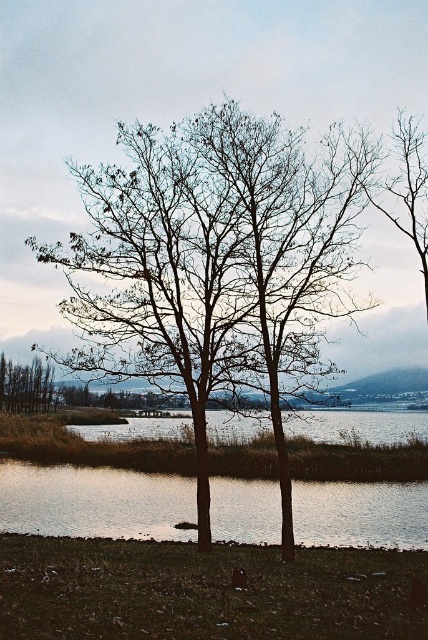
You are an ornithologist observing birds in the scene. You notice two potential nesting spots among the bare branches at center and the brown matte tree at left. Which nesting spot is higher up in the scene?

The bare branches at center is located above the brown matte tree at left, so the nesting spot at the bare branches at center is higher up in the scene.

Consider the image. You are an artist setting up an easel to paint the scene. You want to ensure that the bare branches at center and reflective glass water at center are proportionally accurate in your painting. Which object should you make wider in your artwork to maintain the correct proportions?

The reflective glass water at center should be made wider in the painting since the bare branches at center has a lesser width compared to reflective glass water at center according to the description.

You are an artist planning to paint this scene. You want to ensure the bare branches at center and reflective glass water at center are proportionally accurate. Which object should you make larger in your painting?

The bare branches at center should be made larger in the painting since they are larger in size than the reflective glass water at center according to the description.